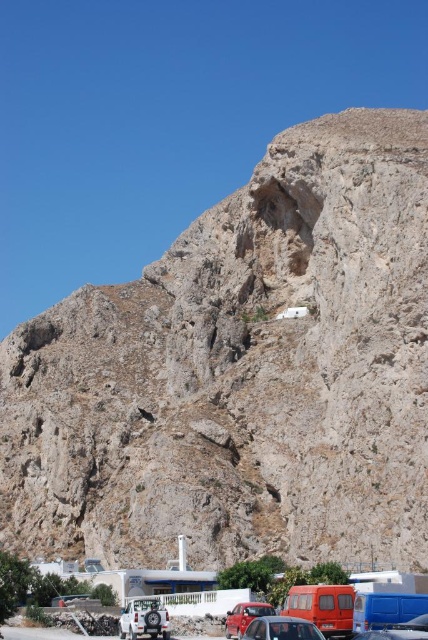
Is white matte truck at lower left smaller than matte red car at center?

Incorrect, white matte truck at lower left is not smaller in size than matte red car at center.

Describe the element at coordinates (143, 618) in the screenshot. The image size is (428, 640). I see `white matte truck at lower left` at that location.

This screenshot has width=428, height=640. I want to click on white matte truck at lower left, so click(143, 618).

Between metallic red car at lower center and matte red car at center, which one is positioned lower?

metallic red car at lower center is lower down.

Which is behind, point (39, 630) or point (232, 618)?

The point (39, 630) is behind.

Based on the photo, who is more distant from viewer, (26,630) or (246,605)?

The point (26,630) is behind.

The image size is (428, 640). Find the location of `metallic red car at lower center`. metallic red car at lower center is located at coordinates (45, 634).

Does white matte truck at lower left come in front of blue metallic van at lower right?

That is False.

What do you see at coordinates (143, 618) in the screenshot? I see `white matte truck at lower left` at bounding box center [143, 618].

The height and width of the screenshot is (640, 428). What do you see at coordinates (143, 618) in the screenshot?
I see `white matte truck at lower left` at bounding box center [143, 618].

At what (x,y) coordinates should I click in order to perform the action: click on white matte truck at lower left. Please return your answer as a coordinate pair (x, y). Looking at the image, I should click on (143, 618).